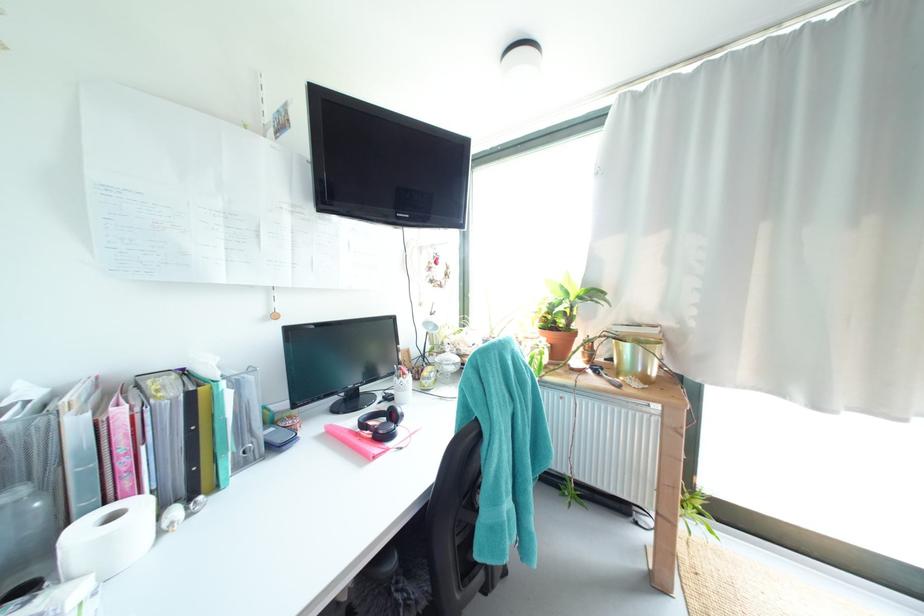
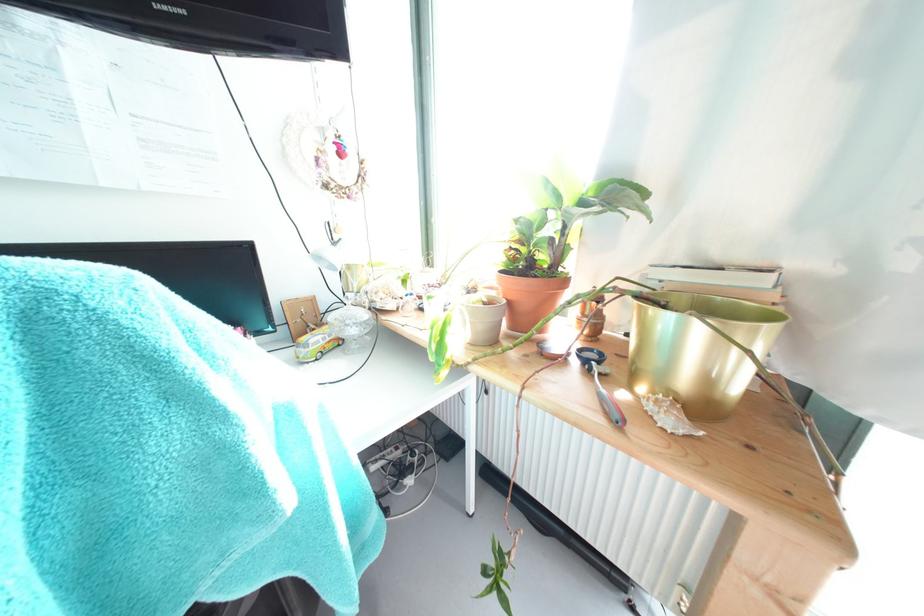
Find the pixel in the second image that matches (x=663, y=333) in the first image.

(771, 283)